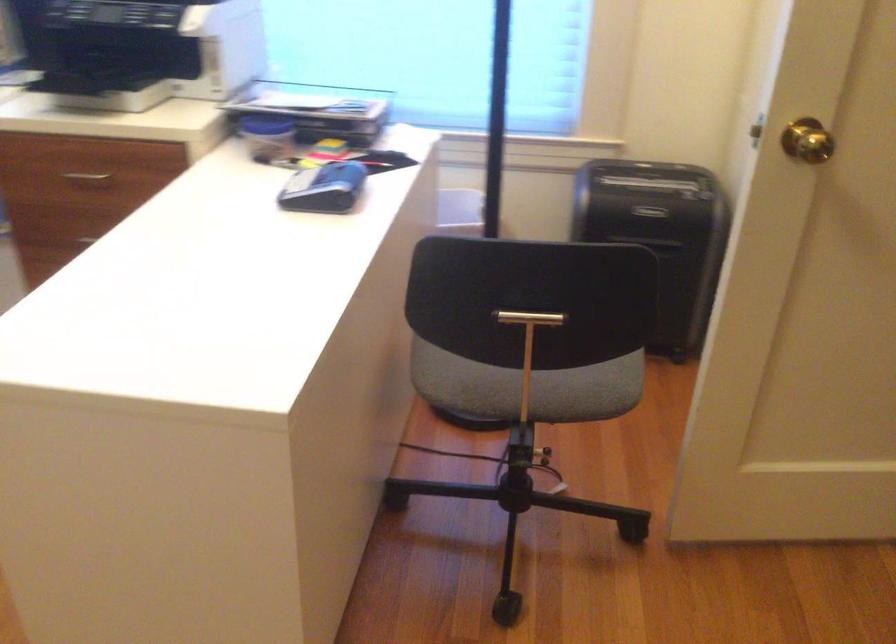
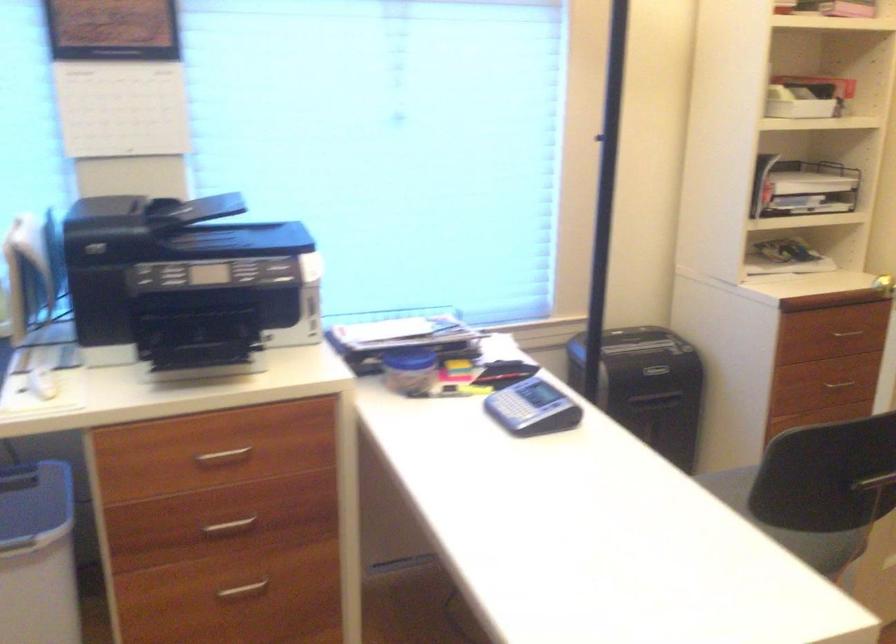
Question: Which direction would the cameraman need to move to produce the second image? Reply with the corresponding letter.

Choices:
 (A) Left
 (B) Right
 (C) Forward
 (D) Backward

Answer: (A)